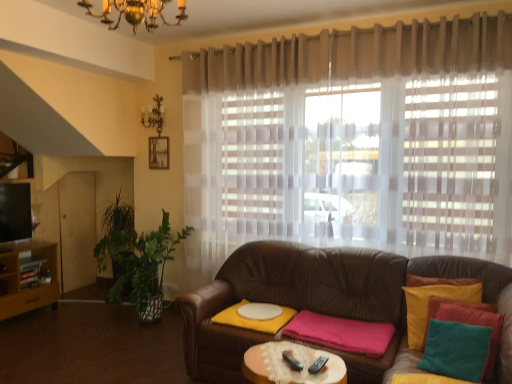
Question: Is brown leather couch at center facing towards sheer beige curtain at upper center?

Choices:
 (A) no
 (B) yes

Answer: (A)

Question: From the image's perspective, is brown leather couch at center above sheer beige curtain at upper center?

Choices:
 (A) no
 (B) yes

Answer: (A)

Question: Is brown leather couch at center positioned in front of sheer beige curtain at upper center?

Choices:
 (A) yes
 (B) no

Answer: (A)

Question: From the image's perspective, is brown leather couch at center located beneath sheer beige curtain at upper center?

Choices:
 (A) no
 (B) yes

Answer: (B)

Question: Is brown leather couch at center thinner than sheer beige curtain at upper center?

Choices:
 (A) no
 (B) yes

Answer: (A)

Question: Is brown leather couch at center positioned far away from sheer beige curtain at upper center?

Choices:
 (A) yes
 (B) no

Answer: (B)

Question: Can you confirm if sheer beige curtain at upper center is smaller than brown leather couch at center?

Choices:
 (A) no
 (B) yes

Answer: (B)

Question: Would you say sheer beige curtain at upper center contains brown leather couch at center?

Choices:
 (A) yes
 (B) no

Answer: (B)

Question: Could you tell me if sheer beige curtain at upper center is facing brown leather couch at center?

Choices:
 (A) no
 (B) yes

Answer: (A)

Question: Considering the relative sizes of sheer beige curtain at upper center and brown leather couch at center in the image provided, is sheer beige curtain at upper center wider than brown leather couch at center?

Choices:
 (A) no
 (B) yes

Answer: (A)

Question: Is sheer beige curtain at upper center positioned far away from brown leather couch at center?

Choices:
 (A) yes
 (B) no

Answer: (B)

Question: Is sheer beige curtain at upper center positioned before brown leather couch at center?

Choices:
 (A) yes
 (B) no

Answer: (B)

Question: Do you think brown leather couch at center is within sheer beige curtain at upper center, or outside of it?

Choices:
 (A) outside
 (B) inside

Answer: (A)